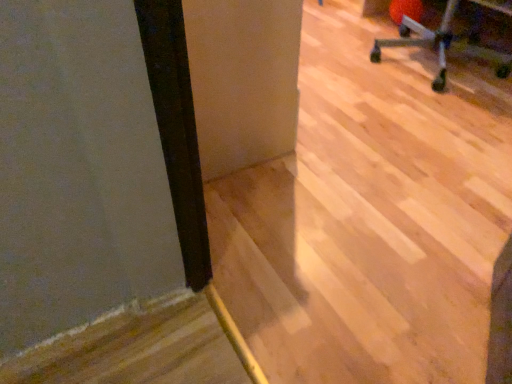
What do you see at coordinates (441, 45) in the screenshot? The height and width of the screenshot is (384, 512). I see `metallic silver chair at upper right` at bounding box center [441, 45].

Locate an element on the screen. The width and height of the screenshot is (512, 384). metallic silver chair at upper right is located at coordinates (441, 45).

Find the location of `metallic silver chair at upper right`. metallic silver chair at upper right is located at coordinates (441, 45).